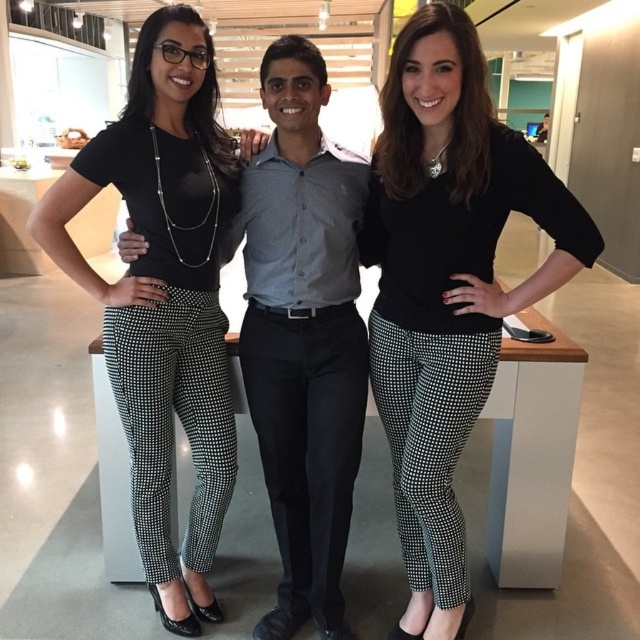
Between black textured pants at center and black textured pants at left, which one is positioned higher?

black textured pants at left is above.

Based on the photo, does black textured pants at center appear over black textured pants at left?

Actually, black textured pants at center is below black textured pants at left.

Between point (515, 195) and point (132, 502), which one is positioned behind?

Point (132, 502)

What are the coordinates of `black textured pants at center` in the screenshot? It's located at (448, 285).